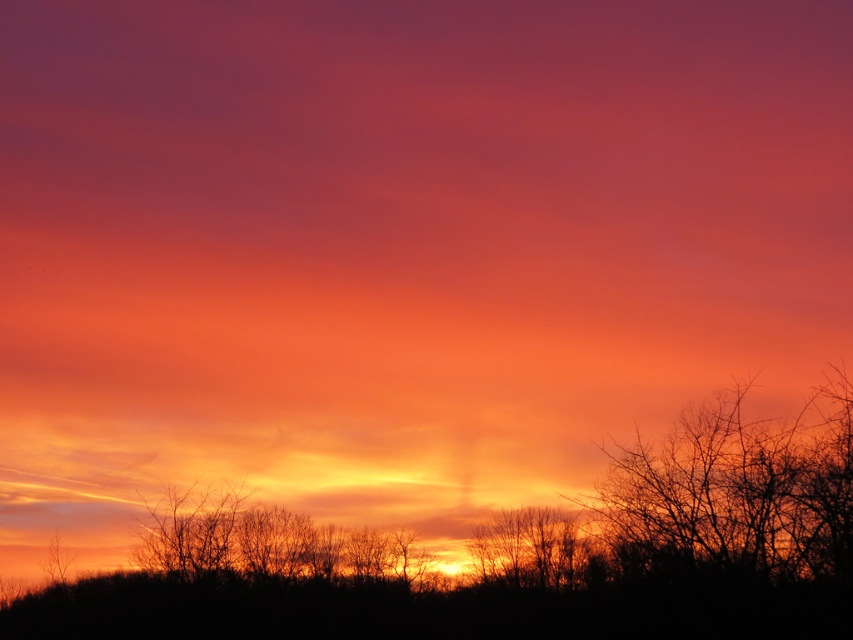
You are standing in the sunset scene and want to take a photo of the silhouette bare branches at right without including the vibrant sunset sky. Where should you position yourself relative to the branches?

To avoid including the vibrant sunset sky in your photo of the silhouette bare branches at right, position yourself to the right side of the branches since they are located at point [735,492], which places them closer to the right edge of the scene.

You are an artist sketching the sunset scene. You want to ensure the silhouette bare branches at right and the silhouette bare tree at center are proportionally accurate. Which object should you draw narrower in your sketch?

The silhouette bare branches at right should be drawn narrower since it has a lesser width compared to the silhouette bare tree at center.